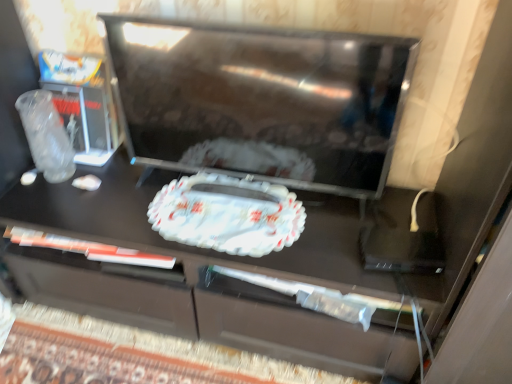
Question: From a real-world perspective, is black glossy tv at center above or below white glossy tray at center?

Choices:
 (A) above
 (B) below

Answer: (A)

Question: Relative to white glossy tray at center, is black glossy tv at center in front or behind?

Choices:
 (A) front
 (B) behind

Answer: (A)

Question: Considering the positions of black glossy tv at center and white glossy tray at center in the image, is black glossy tv at center wider or thinner than white glossy tray at center?

Choices:
 (A) thin
 (B) wide

Answer: (A)

Question: From their relative heights in the image, would you say white glossy tray at center is taller or shorter than black glossy tv at center?

Choices:
 (A) short
 (B) tall

Answer: (A)

Question: Looking at their shapes, would you say white glossy tray at center is wider or thinner than black glossy tv at center?

Choices:
 (A) wide
 (B) thin

Answer: (A)

Question: Considering the positions of point (175, 193) and point (292, 64), is point (175, 193) closer or farther from the camera than point (292, 64)?

Choices:
 (A) closer
 (B) farther

Answer: (B)

Question: Relative to black glossy tv at center, is white glossy tray at center in front or behind?

Choices:
 (A) front
 (B) behind

Answer: (B)